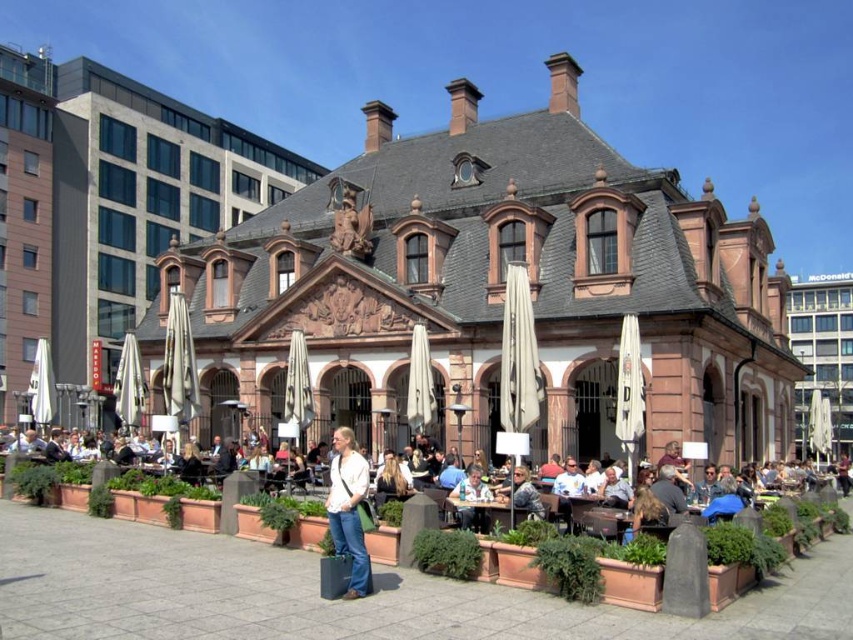
Between white shirt at center and denim jacket at lower center, which one appears on the left side from the viewer's perspective?

Positioned to the left is white shirt at center.

The image size is (853, 640). Identify the location of white shirt at center. (47, 486).

Where is `white shirt at center`? This screenshot has width=853, height=640. white shirt at center is located at coordinates (47, 486).

In the scene shown: Does denim jacket at lower center have a greater width compared to light brown wooden chair at lower center?

Incorrect, denim jacket at lower center's width does not surpass light brown wooden chair at lower center's.

Which is in front, point (509, 483) or point (454, 496)?

Positioned in front is point (454, 496).

At what (x,y) coordinates should I click in order to perform the action: click on denim jacket at lower center. Please return your answer as a coordinate pair (x, y). Looking at the image, I should click on (521, 493).

Is denim jeans at center smaller than light brown wooden chair at lower center?

No.

Is denim jeans at center above light brown wooden chair at lower center?

Correct, denim jeans at center is located above light brown wooden chair at lower center.

Who is more distant from viewer, (341, 486) or (479, 492)?

The point (479, 492) is behind.

I want to click on denim jeans at center, so click(347, 509).